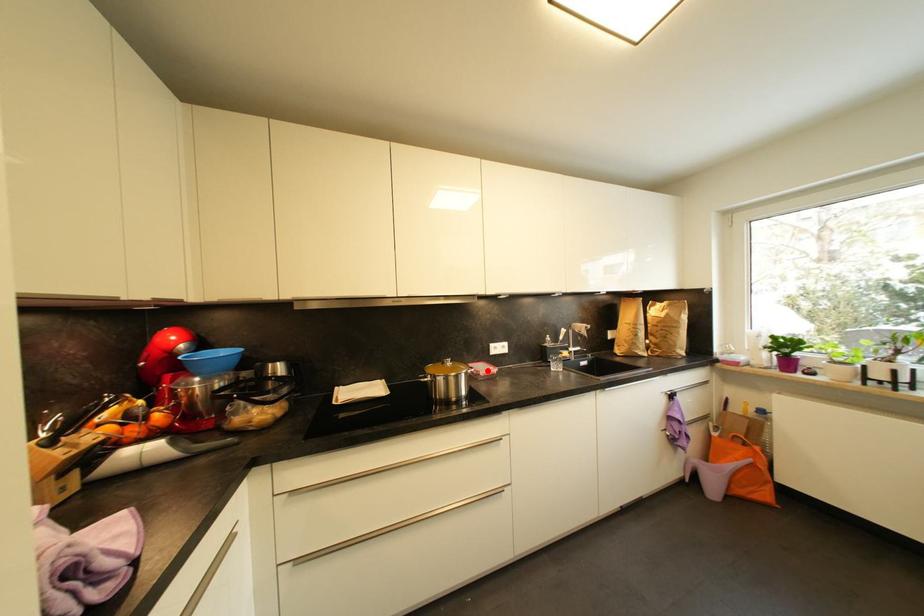
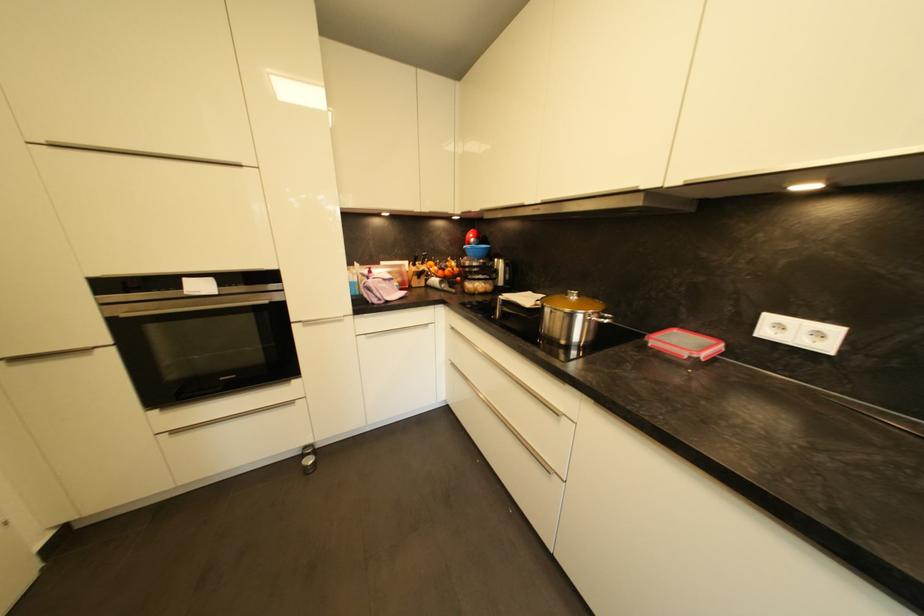
Find the pixel in the second image that matches the highlighted location in the first image.

(686, 345)